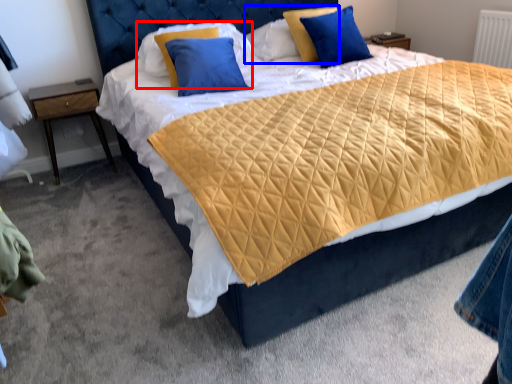
Question: Which object is closer to the camera taking this photo, pillow (highlighted by a red box) or pillow (highlighted by a blue box)?

Choices:
 (A) pillow
 (B) pillow

Answer: (A)